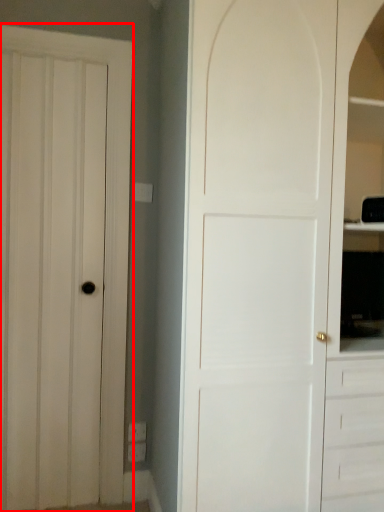
Question: From the image's perspective, what is the correct spatial positioning of door (annotated by the red box) in reference to door?

Choices:
 (A) above
 (B) below

Answer: (B)